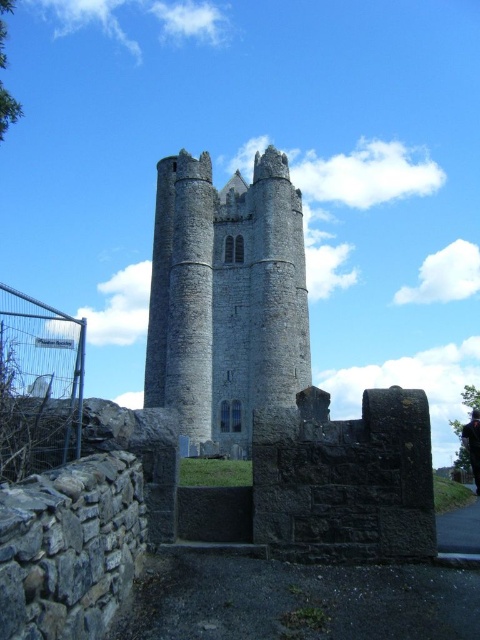
Question: Is gray stone tower at center wider than metal wire fence at lower left?

Choices:
 (A) yes
 (B) no

Answer: (A)

Question: Which point is farther from the camera taking this photo?

Choices:
 (A) (21, 307)
 (B) (148, 403)

Answer: (B)

Question: Among these objects, which one is nearest to the camera?

Choices:
 (A) gray stone tower at center
 (B) metal wire fence at lower left

Answer: (B)

Question: Does gray stone tower at center have a larger size compared to metal wire fence at lower left?

Choices:
 (A) no
 (B) yes

Answer: (B)

Question: Can you confirm if gray stone tower at center is smaller than metal wire fence at lower left?

Choices:
 (A) no
 (B) yes

Answer: (A)